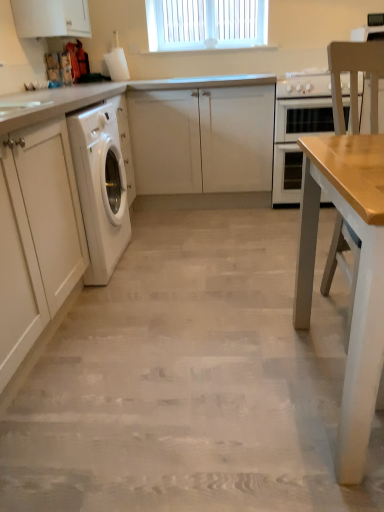
Question: Is white matte cabinet at center, the 1th cabinetry positioned from the back, positioned beyond the bounds of light beige wood floor at center?

Choices:
 (A) no
 (B) yes

Answer: (B)

Question: Is white matte cabinet at center, the 1th cabinetry positioned from the back, at the left side of light beige wood floor at center?

Choices:
 (A) no
 (B) yes

Answer: (B)

Question: Does white matte cabinet at center, the 3th cabinetry in the front-to-back sequence, have a larger size compared to light beige wood floor at center?

Choices:
 (A) no
 (B) yes

Answer: (B)

Question: From the image's perspective, would you say white matte cabinet at center, placed as the 2th cabinetry when sorted from bottom to top, is positioned over light beige wood floor at center?

Choices:
 (A) no
 (B) yes

Answer: (B)

Question: Does white matte cabinet at center, placed as the 2th cabinetry when sorted from bottom to top, appear on the right side of light beige wood floor at center?

Choices:
 (A) no
 (B) yes

Answer: (A)

Question: In terms of height, does white glossy stove at upper right look taller or shorter compared to white glossy oven at center?

Choices:
 (A) short
 (B) tall

Answer: (A)

Question: In terms of size, does white glossy stove at upper right appear bigger or smaller than white glossy oven at center?

Choices:
 (A) small
 (B) big

Answer: (A)

Question: Considering the positions of white glossy stove at upper right and white glossy oven at center in the image, is white glossy stove at upper right wider or thinner than white glossy oven at center?

Choices:
 (A) wide
 (B) thin

Answer: (B)

Question: From the image's perspective, is white glossy stove at upper right positioned above or below white glossy oven at center?

Choices:
 (A) above
 (B) below

Answer: (A)

Question: In the image, is white glossy oven at center positioned in front of or behind light beige wood floor at center?

Choices:
 (A) front
 (B) behind

Answer: (B)

Question: Is white glossy oven at center inside the boundaries of light beige wood floor at center, or outside?

Choices:
 (A) outside
 (B) inside

Answer: (A)

Question: Is white glossy oven at center taller or shorter than light beige wood floor at center?

Choices:
 (A) short
 (B) tall

Answer: (B)

Question: Visually, is white glossy oven at center positioned to the left or to the right of light beige wood floor at center?

Choices:
 (A) right
 (B) left

Answer: (A)

Question: Is white plastic window at upper center inside or outside of white glossy oven at center?

Choices:
 (A) outside
 (B) inside

Answer: (A)

Question: In terms of size, does white plastic window at upper center appear bigger or smaller than white glossy oven at center?

Choices:
 (A) big
 (B) small

Answer: (B)